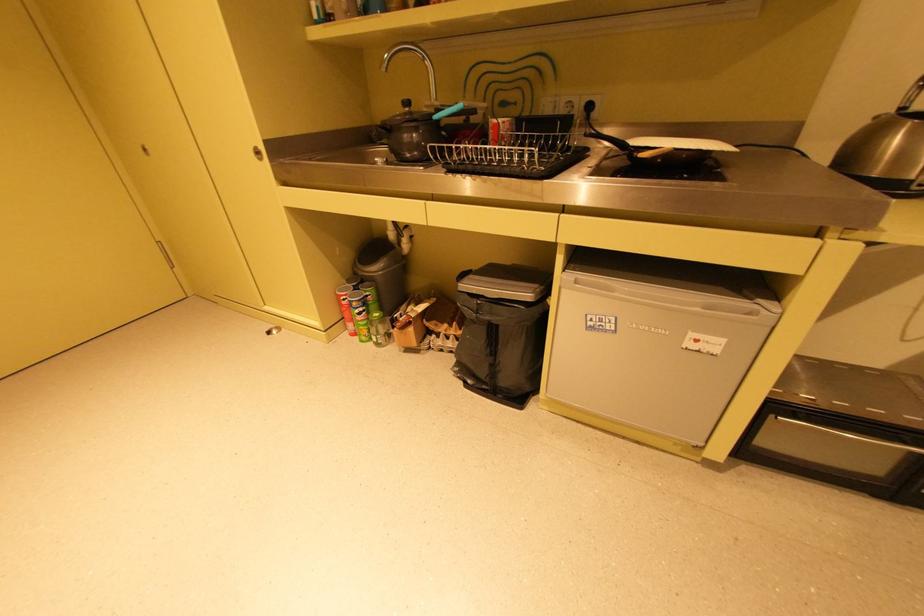
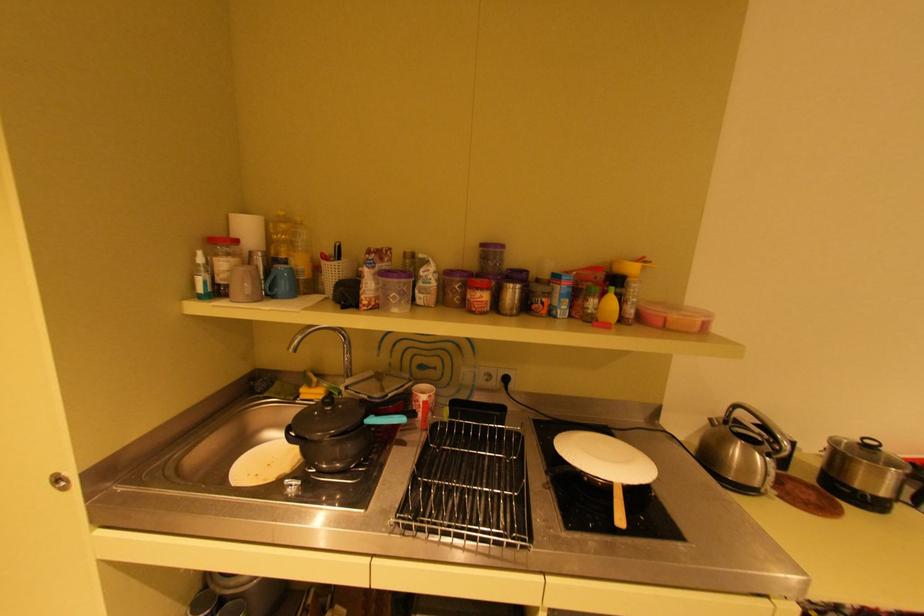
Locate, in the second image, the point that corresponds to the point at 439,119 in the first image.

(371, 424)